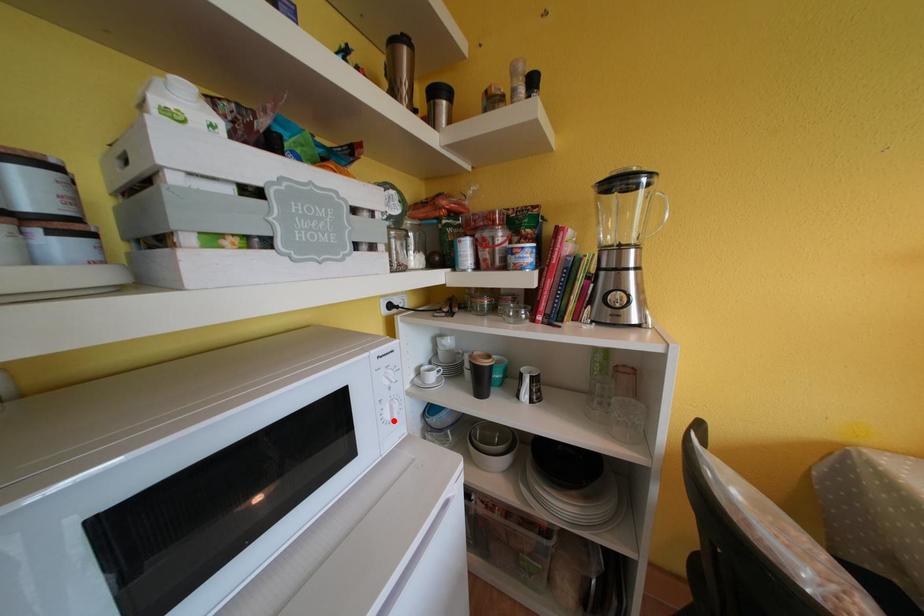
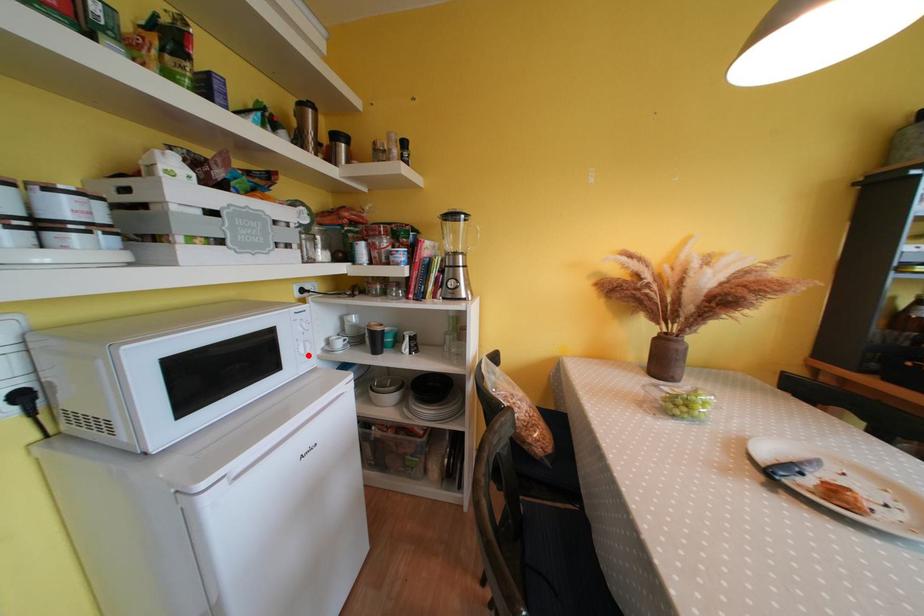
I am providing you with two images of the same scene from different viewpoints. A red point is marked on the first image and another point is marked on the second image. Is the marked point in image1 the same physical position as the marked point in image2?

Yes